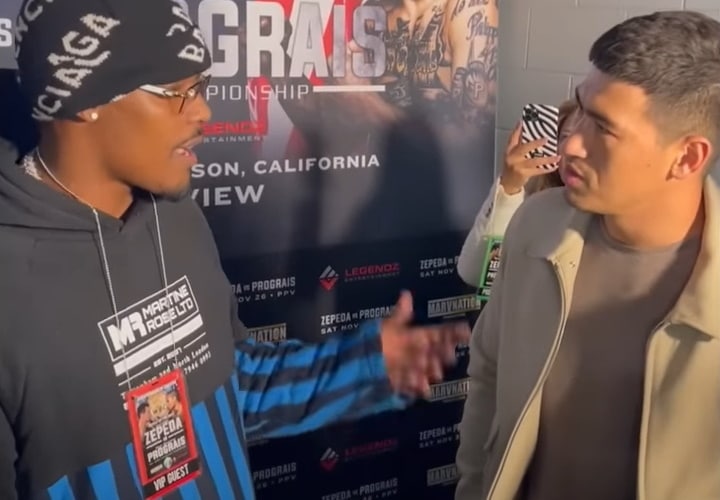
Image resolution: width=720 pixels, height=500 pixels. In order to click on promotional banner on wall in this screenshot , I will do `click(255, 230)`.